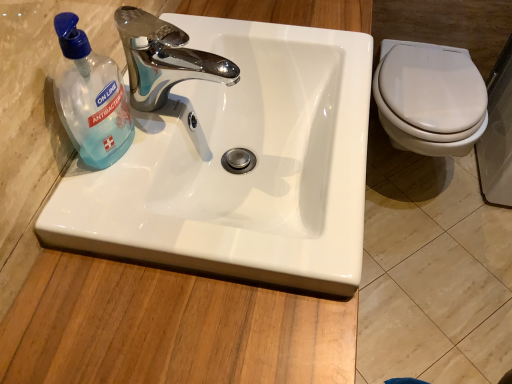
Question: Considering the positions of transparent plastic bottle at left and white glossy sink at center in the image, is transparent plastic bottle at left taller or shorter than white glossy sink at center?

Choices:
 (A) tall
 (B) short

Answer: (A)

Question: From a real-world perspective, is transparent plastic bottle at left above or below white glossy sink at center?

Choices:
 (A) above
 (B) below

Answer: (A)

Question: Considering the real-world distances, which object is farthest from the transparent plastic bottle at left?

Choices:
 (A) chrome/metallic faucet at upper center
 (B) white glossy sink at center

Answer: (B)

Question: Based on their relative distances, which object is farther from the white glossy sink at center?

Choices:
 (A) chrome/metallic faucet at upper center
 (B) transparent plastic bottle at left

Answer: (B)